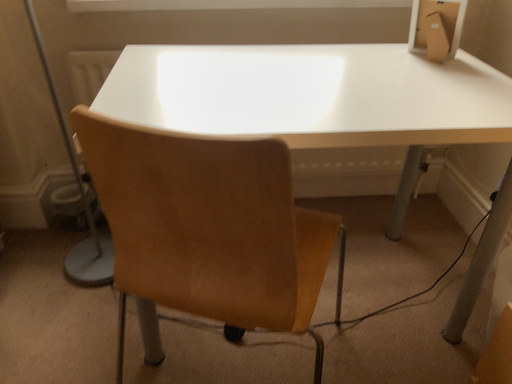
Question: Is white glossy table at center oriented towards light brown leather chair at center?

Choices:
 (A) no
 (B) yes

Answer: (B)

Question: From a real-world perspective, does white glossy table at center sit lower than light brown leather chair at center?

Choices:
 (A) no
 (B) yes

Answer: (B)

Question: From the image's perspective, is white glossy table at center beneath light brown leather chair at center?

Choices:
 (A) yes
 (B) no

Answer: (B)

Question: Can you confirm if white glossy table at center is smaller than light brown leather chair at center?

Choices:
 (A) no
 (B) yes

Answer: (A)

Question: Considering the relative sizes of white glossy table at center and light brown leather chair at center in the image provided, is white glossy table at center bigger than light brown leather chair at center?

Choices:
 (A) no
 (B) yes

Answer: (B)

Question: From a real-world perspective, relative to white matte window frame at upper center, is light brown leather chair at center vertically above or below?

Choices:
 (A) below
 (B) above

Answer: (A)

Question: Is point (209, 248) positioned closer to the camera than point (89, 8)?

Choices:
 (A) farther
 (B) closer

Answer: (B)

Question: Is light brown leather chair at center bigger or smaller than white matte window frame at upper center?

Choices:
 (A) big
 (B) small

Answer: (A)

Question: Looking at their shapes, would you say light brown leather chair at center is wider or thinner than white matte window frame at upper center?

Choices:
 (A) wide
 (B) thin

Answer: (A)

Question: Is light brown leather chair at center wider or thinner than white glossy table at center?

Choices:
 (A) wide
 (B) thin

Answer: (B)

Question: Is point (262, 304) positioned closer to the camera than point (406, 102)?

Choices:
 (A) closer
 (B) farther

Answer: (A)

Question: From the image's perspective, is light brown leather chair at center positioned above or below white glossy table at center?

Choices:
 (A) above
 (B) below

Answer: (B)

Question: Relative to white glossy table at center, is light brown leather chair at center in front or behind?

Choices:
 (A) behind
 (B) front

Answer: (B)

Question: Relative to light brown leather chair at center, is white glossy table at center in front or behind?

Choices:
 (A) behind
 (B) front

Answer: (A)

Question: Would you say white glossy table at center is to the left or to the right of light brown leather chair at center in the picture?

Choices:
 (A) right
 (B) left

Answer: (A)